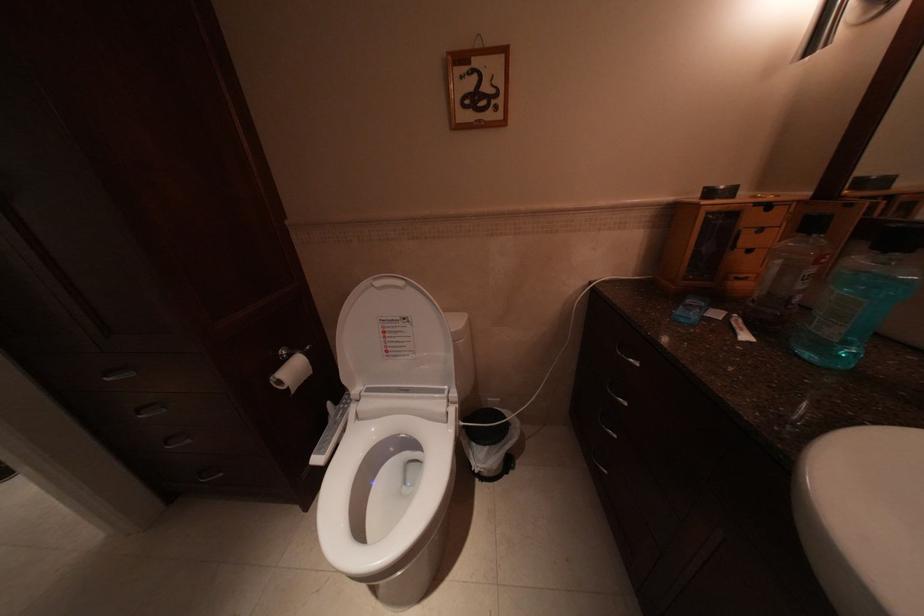
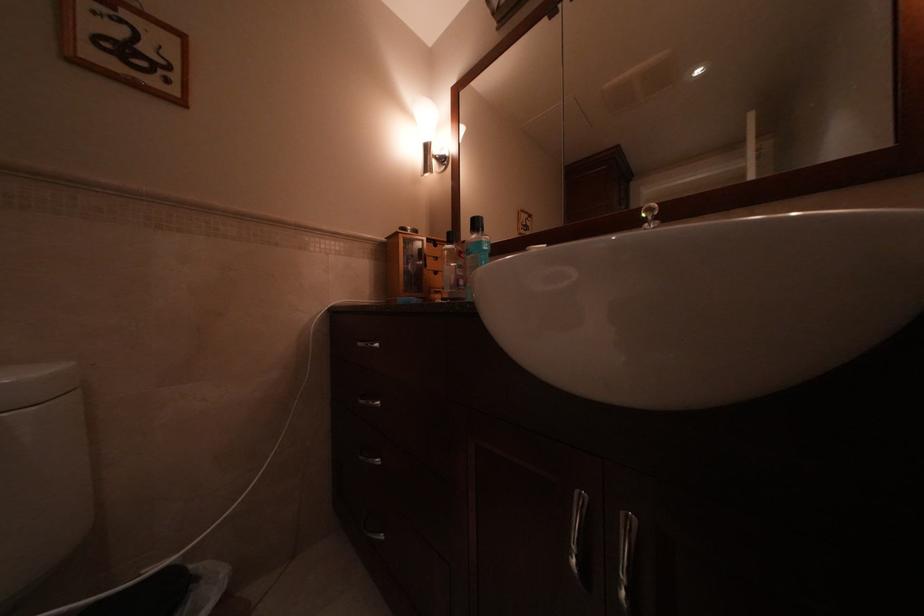
The images are taken continuously from a first-person perspective. In which direction is your viewpoint rotating?

The camera rotated toward right-up.